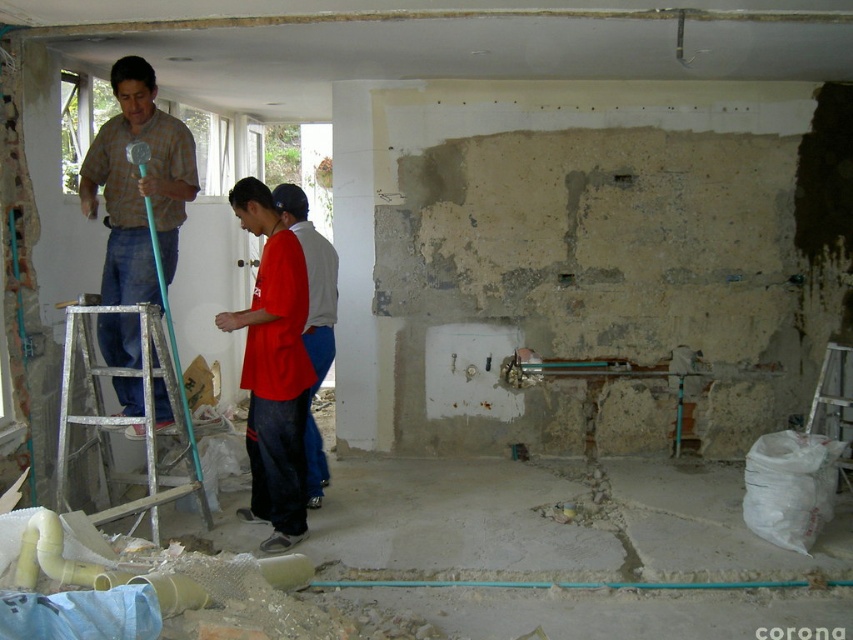
Based on the photo, does plaid shirt at upper left have a larger size compared to white plastic ladder at center right?

Actually, plaid shirt at upper left might be smaller than white plastic ladder at center right.

Does plaid shirt at upper left appear on the left side of white plastic ladder at center right?

Indeed, plaid shirt at upper left is positioned on the left side of white plastic ladder at center right.

This screenshot has width=853, height=640. I want to click on plaid shirt at upper left, so click(138, 186).

In order to click on plaid shirt at upper left in this screenshot , I will do `click(138, 186)`.

Is matte red shirt at center in front of red matte shirt at center?

Yes, matte red shirt at center is closer to the viewer.

Find the location of a particular element. matte red shirt at center is located at coordinates (273, 369).

Is the position of red matte shirt at center less distant than that of white plastic ladder at center right?

That is True.

The width and height of the screenshot is (853, 640). What do you see at coordinates (312, 321) in the screenshot? I see `red matte shirt at center` at bounding box center [312, 321].

You are a GUI agent. You are given a task and a screenshot of the screen. Output one action in this format:
    pyautogui.click(x=<x>, y=<y>)
    Task: Click on the red matte shirt at center
    The width and height of the screenshot is (853, 640).
    Given the screenshot: What is the action you would take?
    pyautogui.click(x=312, y=321)